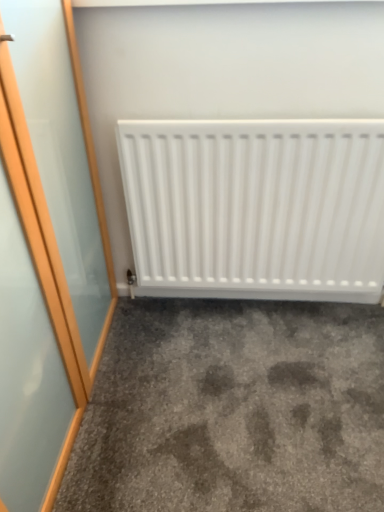
What do you see at coordinates (234, 409) in the screenshot?
I see `gray carpet at lower center` at bounding box center [234, 409].

Measure the distance between gray carpet at lower center and camera.

The distance of gray carpet at lower center from camera is 3.75 feet.

At what (x,y) coordinates should I click in order to perform the action: click on gray carpet at lower center. Please return your answer as a coordinate pair (x, y). The image size is (384, 512). Looking at the image, I should click on (234, 409).

You are a GUI agent. You are given a task and a screenshot of the screen. Output one action in this format:
    pyautogui.click(x=<x>, y=<y>)
    Task: Click on the white matte radiator at center
    The height and width of the screenshot is (512, 384).
    Given the screenshot: What is the action you would take?
    pyautogui.click(x=255, y=208)

Image resolution: width=384 pixels, height=512 pixels. Describe the element at coordinates (255, 208) in the screenshot. I see `white matte radiator at center` at that location.

I want to click on gray carpet at lower center, so click(x=234, y=409).

Which object is positioned more to the left, white matte radiator at center or gray carpet at lower center?

From the viewer's perspective, gray carpet at lower center appears more on the left side.

Which object is closer to the camera, white matte radiator at center or gray carpet at lower center?

gray carpet at lower center.

Which is behind, point (283, 289) or point (191, 395)?

The point (283, 289) is farther from the camera.

From the image's perspective, which object appears higher, white matte radiator at center or gray carpet at lower center?

white matte radiator at center is shown above in the image.

From a real-world perspective, which is physically above, white matte radiator at center or gray carpet at lower center?

white matte radiator at center.

Which of these two, white matte radiator at center or gray carpet at lower center, is thinner?

white matte radiator at center is thinner.

Based on the photo, in terms of height, does white matte radiator at center look taller or shorter compared to gray carpet at lower center?

Clearly, white matte radiator at center is taller compared to gray carpet at lower center.

Does white matte radiator at center have a smaller size compared to gray carpet at lower center?

Incorrect, white matte radiator at center is not smaller in size than gray carpet at lower center.

Is white matte radiator at center inside the boundaries of gray carpet at lower center, or outside?

white matte radiator at center lies outside gray carpet at lower center.

Would you say white matte radiator at center is a long distance from gray carpet at lower center?

No, white matte radiator at center is not far away from gray carpet at lower center.

Is white matte radiator at center aimed at gray carpet at lower center?

Yes.

The height and width of the screenshot is (512, 384). Identify the location of concrete on the left of white matte radiator at center. (234, 409).

Between gray carpet at lower center and white matte radiator at center, which one appears on the left side from the viewer's perspective?

gray carpet at lower center is more to the left.

Does gray carpet at lower center come behind white matte radiator at center?

No, the depth of gray carpet at lower center is less than that of white matte radiator at center.

Does point (377, 306) come closer to viewer compared to point (191, 258)?

No.

From the image's perspective, between gray carpet at lower center and white matte radiator at center, which one is located above?

From the image's view, white matte radiator at center is above.

From a real-world perspective, which is physically below, gray carpet at lower center or white matte radiator at center?

gray carpet at lower center.

Considering the relative sizes of gray carpet at lower center and white matte radiator at center in the image provided, is gray carpet at lower center thinner than white matte radiator at center?

Incorrect, the width of gray carpet at lower center is not less than that of white matte radiator at center.

Considering the sizes of objects gray carpet at lower center and white matte radiator at center in the image provided, who is shorter, gray carpet at lower center or white matte radiator at center?

With less height is gray carpet at lower center.

Considering the sizes of objects gray carpet at lower center and white matte radiator at center in the image provided, who is bigger, gray carpet at lower center or white matte radiator at center?

white matte radiator at center is bigger.

Is white matte radiator at center located within gray carpet at lower center?

Definitely not — white matte radiator at center is not inside gray carpet at lower center.

Is gray carpet at lower center not close to white matte radiator at center?

No, gray carpet at lower center is not far away from white matte radiator at center.

Is gray carpet at lower center positioned with its back to white matte radiator at center?

No, gray carpet at lower center is not facing away from white matte radiator at center.

Locate an element on the screen. This screenshot has width=384, height=512. concrete to the left of white matte radiator at center is located at coordinates (234, 409).

This screenshot has height=512, width=384. I want to click on radiator lying on the right of gray carpet at lower center, so click(x=255, y=208).

This screenshot has width=384, height=512. I want to click on concrete on the left of white matte radiator at center, so click(x=234, y=409).